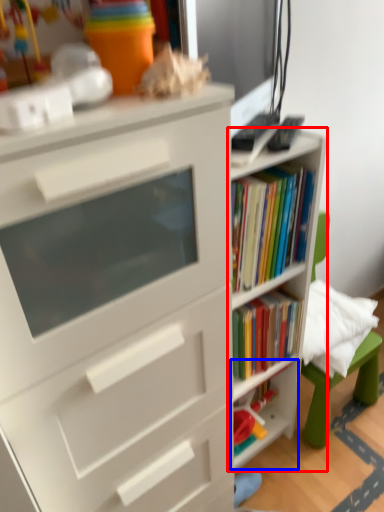
Question: Which point is closer to the camera, shelf (highlighted by a red box) or shelf (highlighted by a blue box)?

Choices:
 (A) shelf
 (B) shelf

Answer: (A)